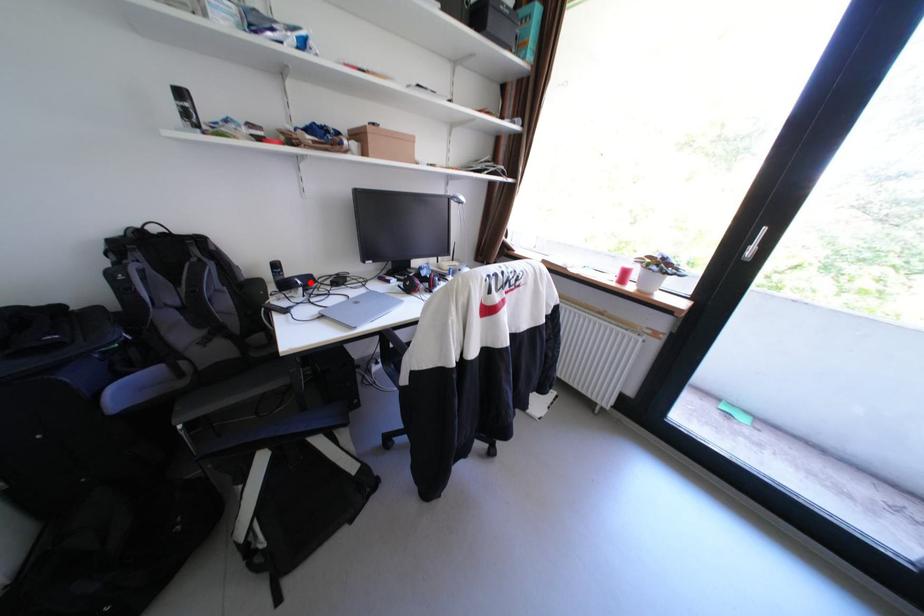
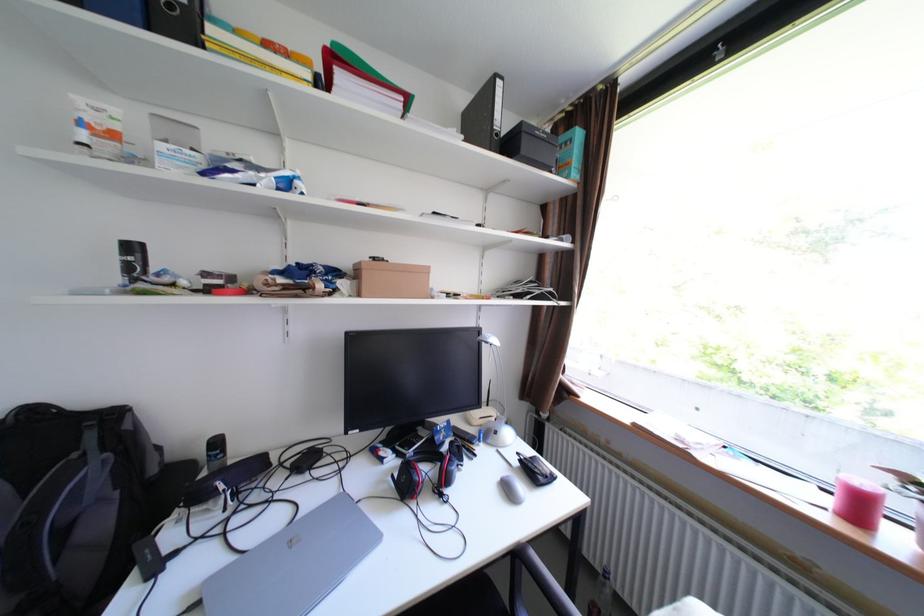
In the second image, find the point that corresponds to the highlighted location in the first image.

(233, 488)